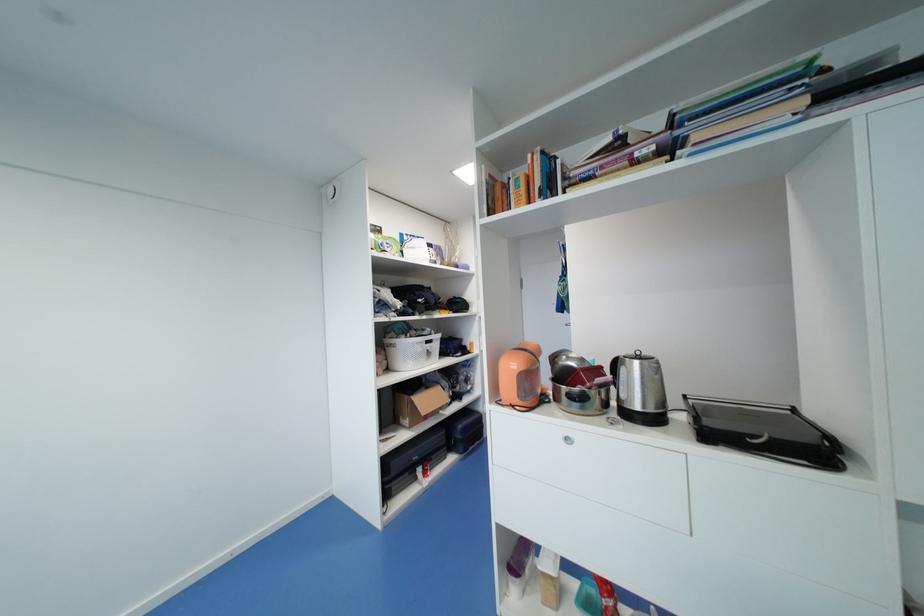
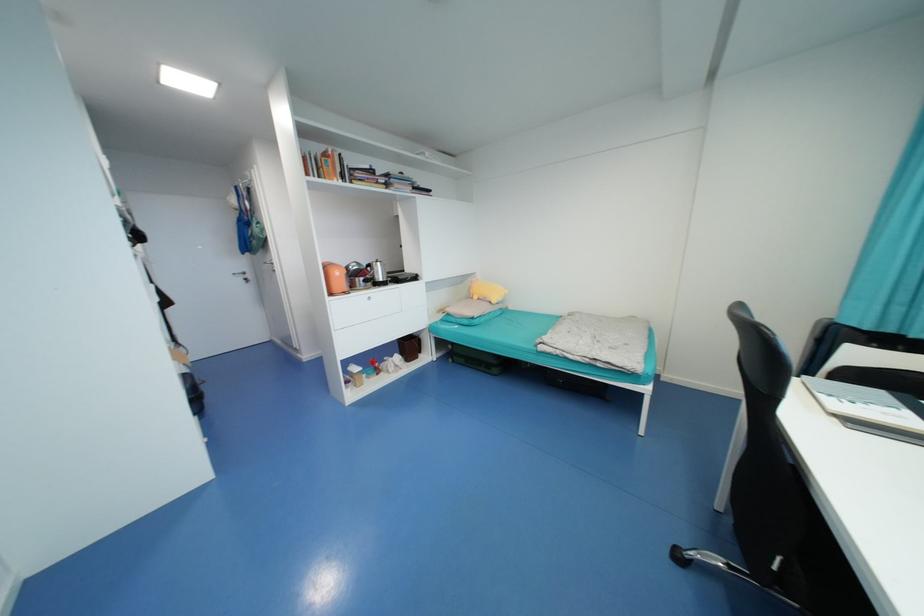
Where in the second image is the point corresponding to pixel 699 138 from the first image?

(399, 187)